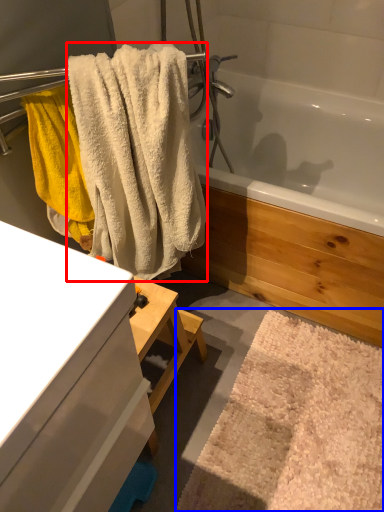
Question: Which of the following is the closest to the observer, towel (highlighted by a red box) or bath mat (highlighted by a blue box)?

Choices:
 (A) towel
 (B) bath mat

Answer: (A)